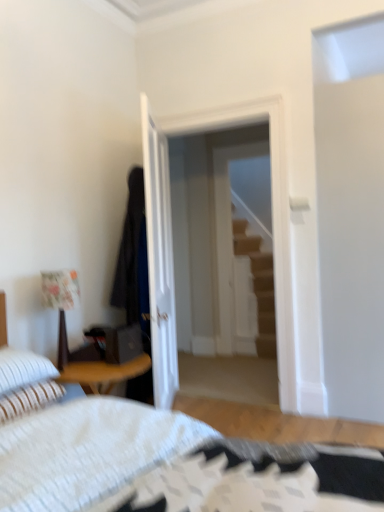
This screenshot has height=512, width=384. What are the coordinates of `free location in front of wooden staircase at center` in the screenshot? It's located at (250, 364).